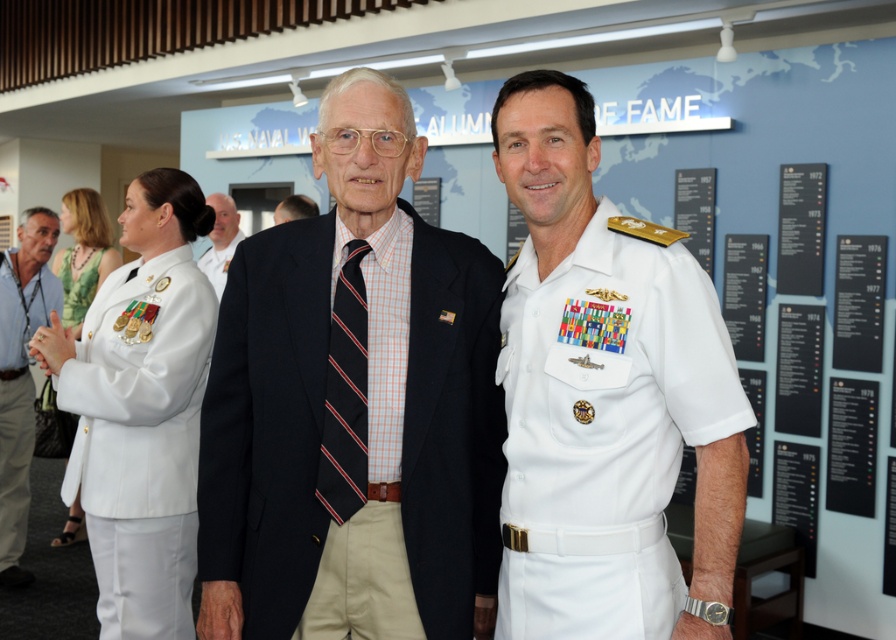
Based on the scene description, which object is taller between the white uniform at center and the navy blue fabric suit at center?

The white uniform at center is much taller than the navy blue fabric suit at center.

Two men are standing at point (351,337). How far apart are they?

The two men at point (351,337) are 7.41 feet apart.